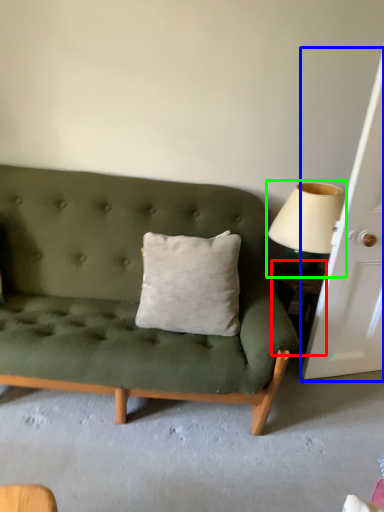
Question: Which object is the farthest from table (highlighted by a red box)? Choose among these: door (highlighted by a blue box) or table lamp (highlighted by a green box).

Choices:
 (A) door
 (B) table lamp

Answer: (A)